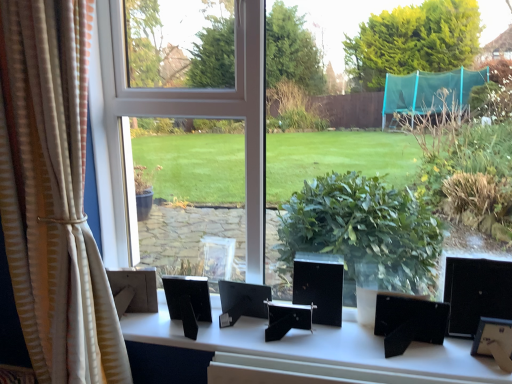
Question: Can you confirm if beige striped curtain at left is wider than transparent glass window at center?

Choices:
 (A) yes
 (B) no

Answer: (B)

Question: Is beige striped curtain at left turned away from transparent glass window at center?

Choices:
 (A) yes
 (B) no

Answer: (A)

Question: From the image's perspective, is beige striped curtain at left below transparent glass window at center?

Choices:
 (A) yes
 (B) no

Answer: (A)

Question: Would you say transparent glass window at center is part of beige striped curtain at left's contents?

Choices:
 (A) no
 (B) yes

Answer: (A)

Question: Is beige striped curtain at left taller than transparent glass window at center?

Choices:
 (A) no
 (B) yes

Answer: (B)

Question: Is beige striped curtain at left to the right of transparent glass window at center from the viewer's perspective?

Choices:
 (A) no
 (B) yes

Answer: (A)

Question: Is black plastic picture frames at center outside of transparent glass window at center?

Choices:
 (A) yes
 (B) no

Answer: (A)

Question: Is black plastic picture frames at center at the left side of transparent glass window at center?

Choices:
 (A) yes
 (B) no

Answer: (B)

Question: Does black plastic picture frames at center have a greater height compared to transparent glass window at center?

Choices:
 (A) yes
 (B) no

Answer: (B)

Question: Is black plastic picture frames at center surrounding transparent glass window at center?

Choices:
 (A) yes
 (B) no

Answer: (B)

Question: Does black plastic picture frames at center have a larger size compared to transparent glass window at center?

Choices:
 (A) no
 (B) yes

Answer: (A)

Question: Is transparent glass window at center at the back of black plastic picture frames at center?

Choices:
 (A) yes
 (B) no

Answer: (B)

Question: Is beige striped curtain at left looking in the opposite direction of black plastic picture frames at center?

Choices:
 (A) no
 (B) yes

Answer: (A)